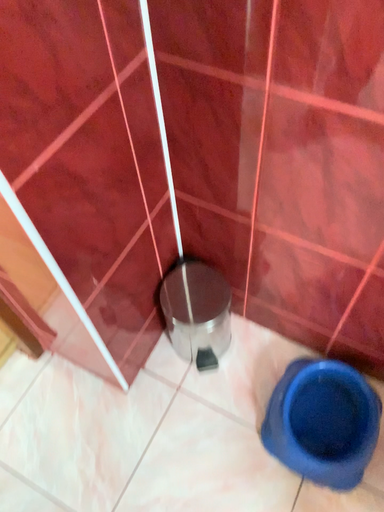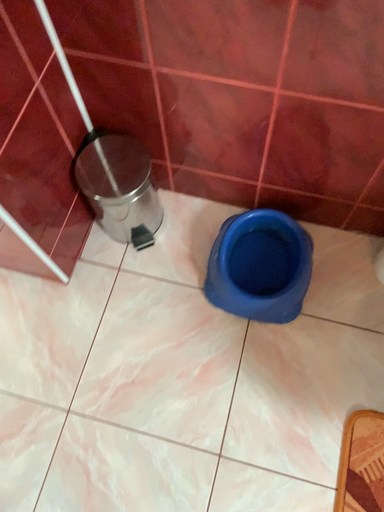
Question: How did the camera likely rotate when shooting the video?

Choices:
 (A) rotated upward
 (B) rotated downward

Answer: (B)